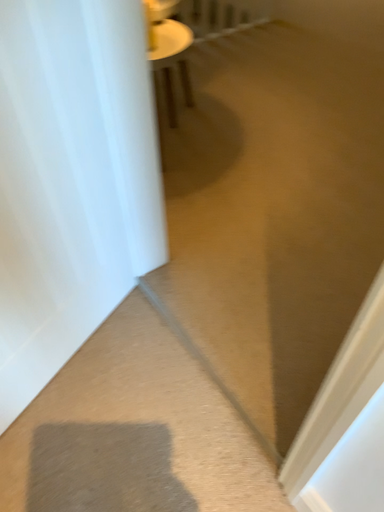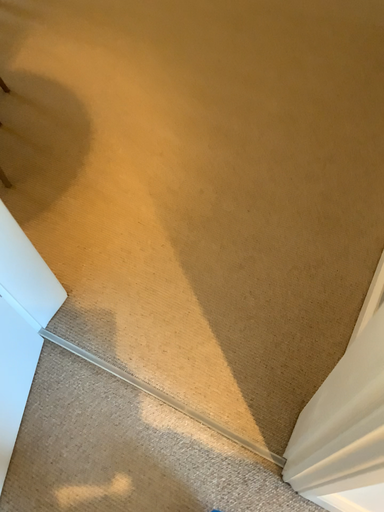
Question: Which way did the camera rotate in the video?

Choices:
 (A) rotated right
 (B) rotated left

Answer: (A)